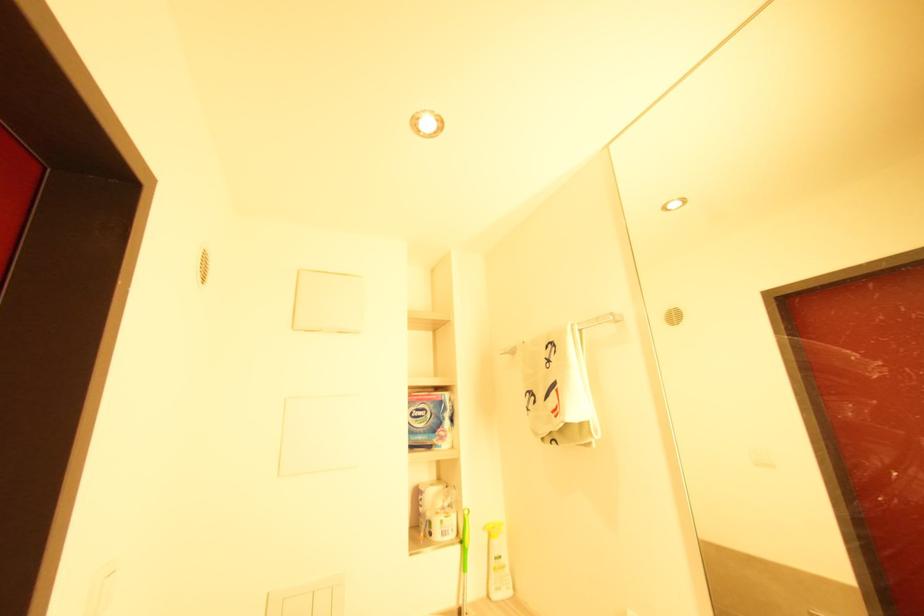
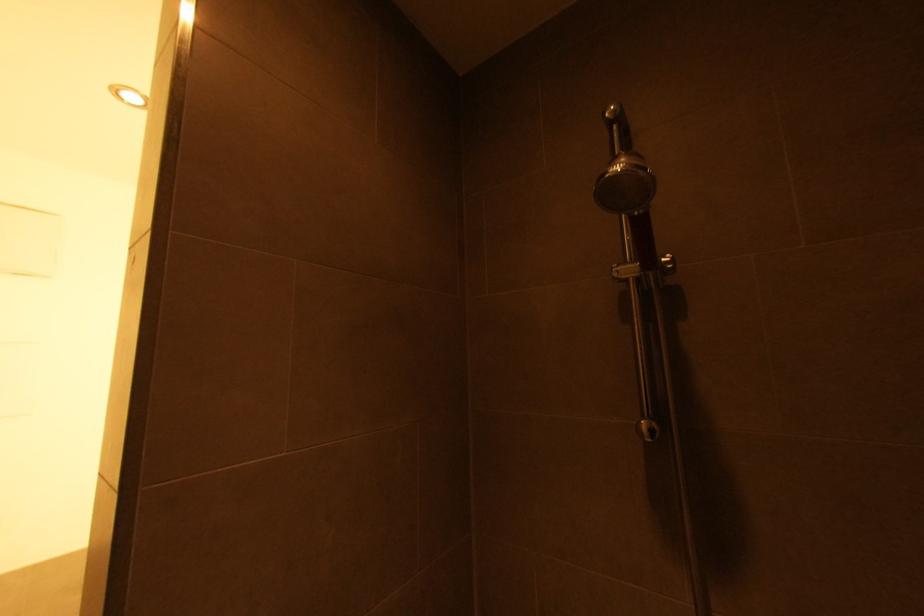
Question: The camera is either moving clockwise (left) or counter-clockwise (right) around the object. The first image is from the beginning of the video and the second image is from the end. Is the camera moving left or right when shooting the video?

Choices:
 (A) Left
 (B) Right

Answer: (A)